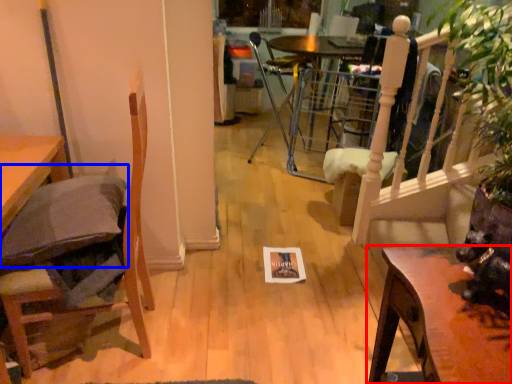
Question: Which object appears closest to the camera in this image, table (highlighted by a red box) or pillow (highlighted by a blue box)?

Choices:
 (A) table
 (B) pillow

Answer: (A)